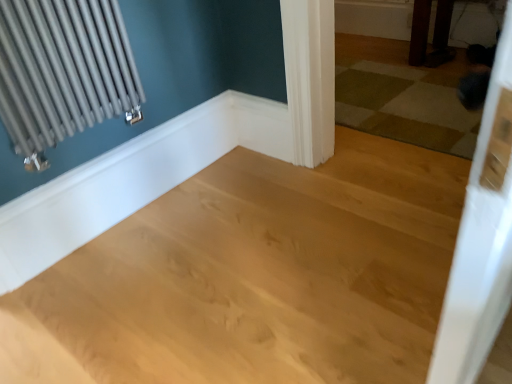
You are a GUI agent. You are given a task and a screenshot of the screen. Output one action in this format:
    pyautogui.click(x=<x>, y=<y>)
    Task: Click on the transparent glass screen door at right
    
    Given the screenshot: What is the action you would take?
    pyautogui.click(x=481, y=239)

Measure the distance between point (505,22) and camera.

The distance of point (505,22) from camera is 39.90 centimeters.

The height and width of the screenshot is (384, 512). Describe the element at coordinates (481, 239) in the screenshot. I see `transparent glass screen door at right` at that location.

Identify the location of transparent glass screen door at right. The image size is (512, 384). (481, 239).